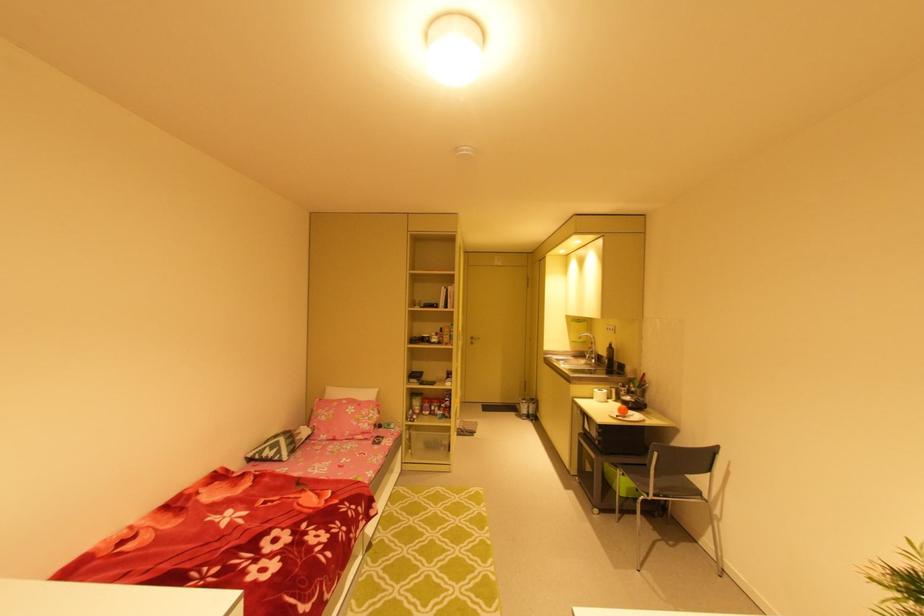
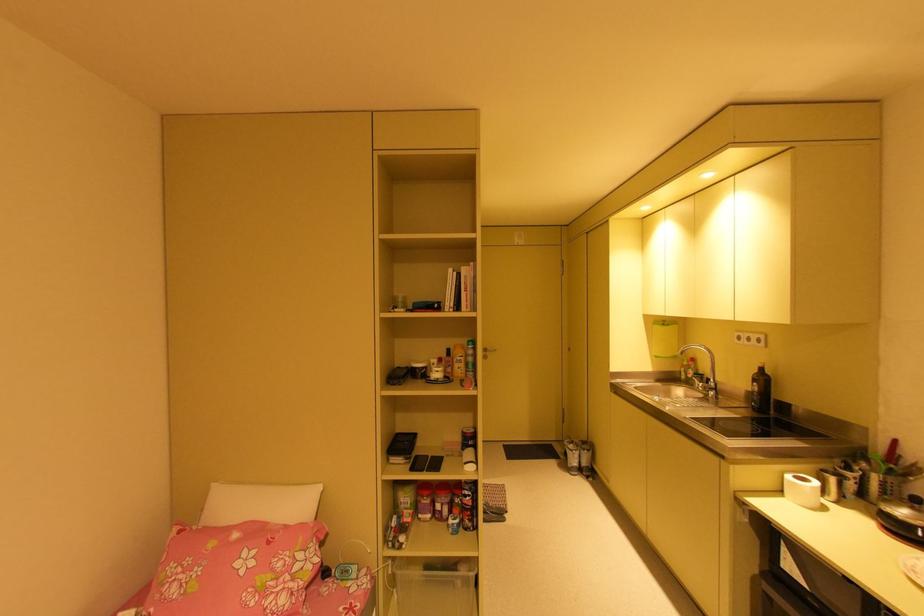
Question: What movement of the cameraman would produce the second image?

Choices:
 (A) Left
 (B) Right
 (C) Forward
 (D) Backward

Answer: (C)